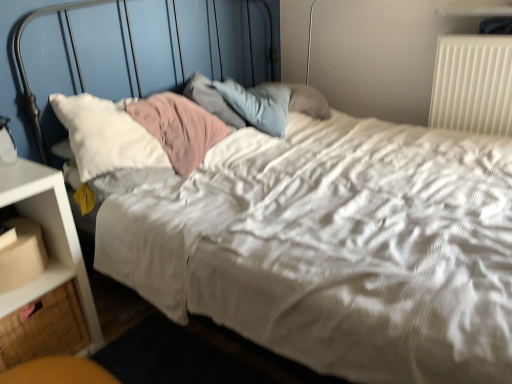
The image size is (512, 384). Find the location of `free space above matte cardboard box at lower left (from a real-world perspective)`. free space above matte cardboard box at lower left (from a real-world perspective) is located at coordinates (15, 228).